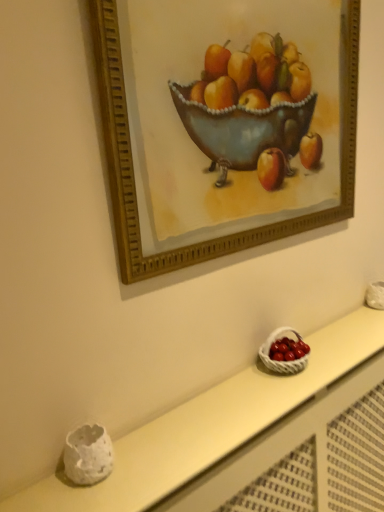
Locate an element on the screen. blank space situated above white wicker basket at lower right (from a real-world perspective) is located at coordinates (249, 382).